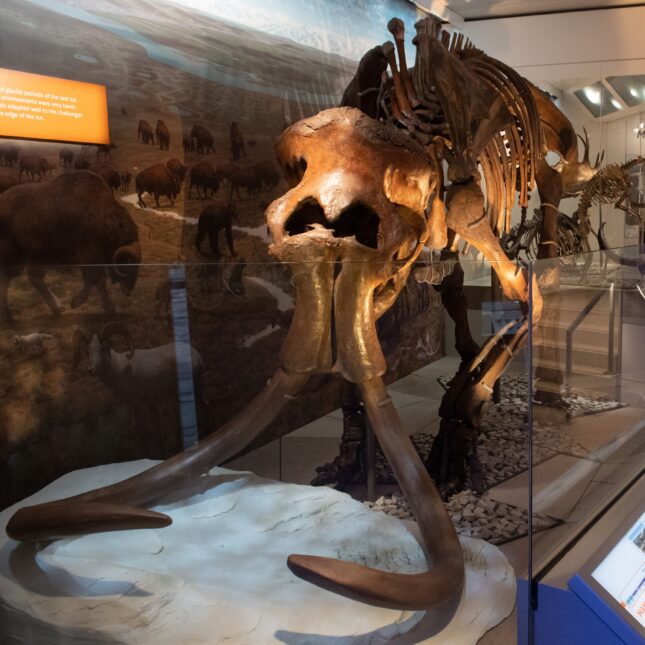
You are a GUI agent. You are given a task and a screenshot of the screen. Output one action in this format:
    pyautogui.click(x=<x>, y=<y>)
    Task: Click on the picture
    The image size is (645, 645).
    Given the screenshot: What is the action you would take?
    pyautogui.click(x=139, y=194)